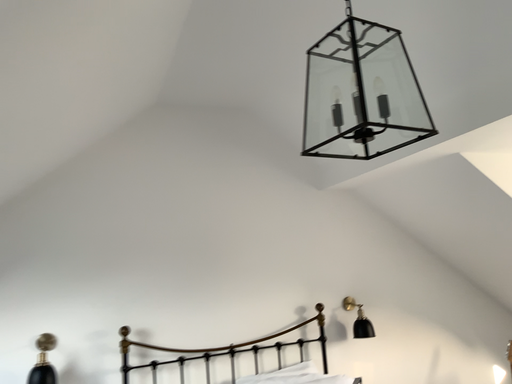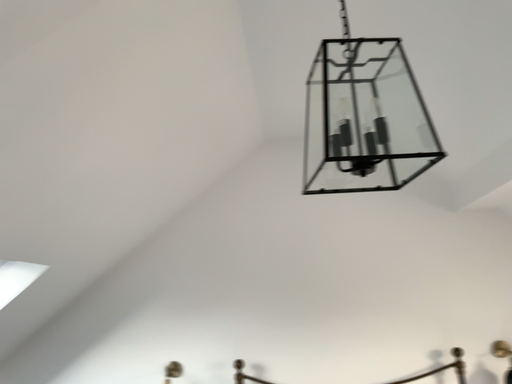
Question: Which way did the camera rotate in the video?

Choices:
 (A) rotated left
 (B) rotated right

Answer: (A)